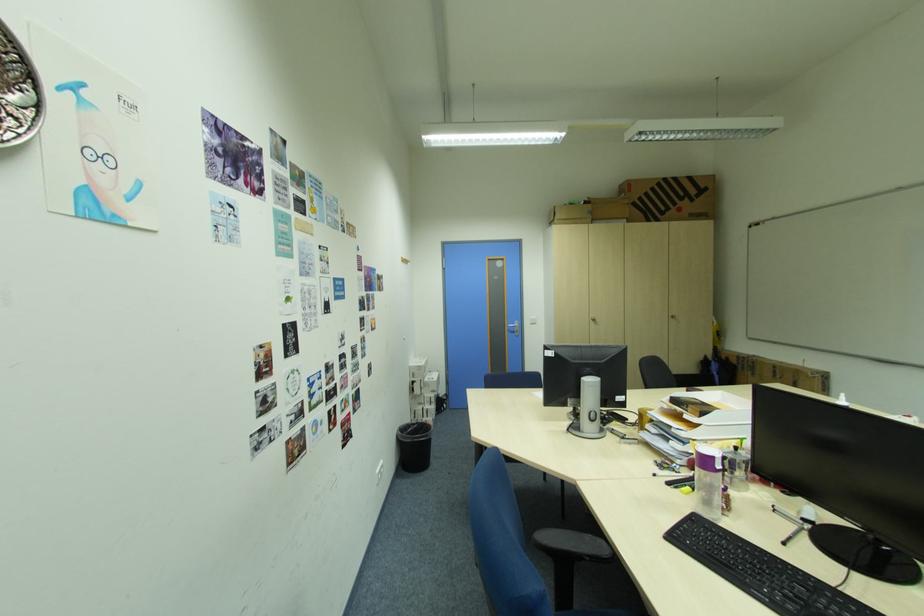
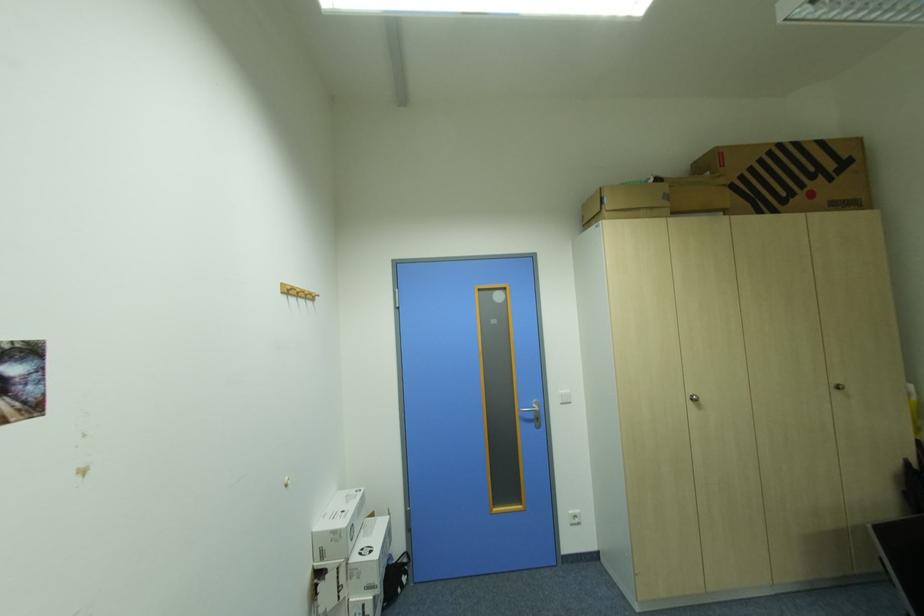
Find the pixel in the second image that matches the point at 441,392 in the first image.

(377, 590)